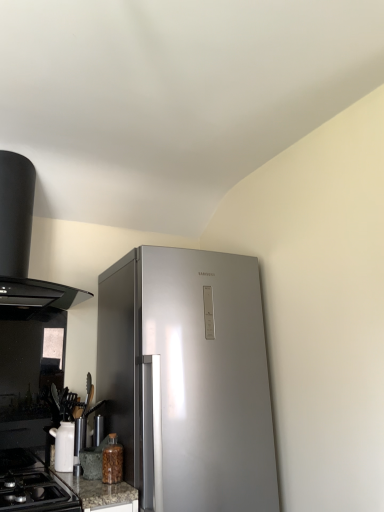
Where is `blank space situated above black matte range hood at upper left (from a real-world perspective)`? blank space situated above black matte range hood at upper left (from a real-world perspective) is located at coordinates (39, 150).